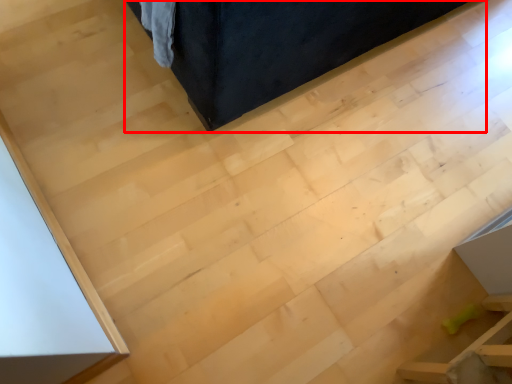
Question: From the image's perspective, what is the correct spatial relationship of furniture (annotated by the red box) in relation to furniture?

Choices:
 (A) above
 (B) below

Answer: (A)